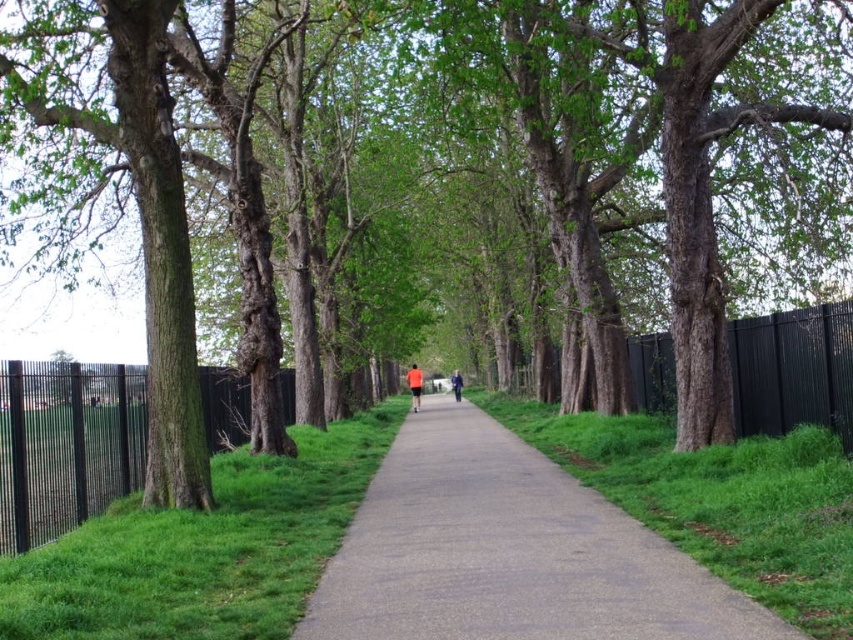
Is gray asphalt path at center shorter than orange fabric at center?

Yes.

Is point (534, 547) behind point (421, 385)?

No, it is not.

Identify the location of gray asphalt path at center. click(509, 552).

Is gray asphalt path at center smaller than orange fabric jacket at center?

Actually, gray asphalt path at center might be larger than orange fabric jacket at center.

Who is more distant from viewer, (451, 611) or (457, 400)?

The point (457, 400) is behind.

Who is more distant from viewer, (589, 548) or (457, 387)?

The point (457, 387) is behind.

Where is `gray asphalt path at center`? This screenshot has width=853, height=640. gray asphalt path at center is located at coordinates (509, 552).

Who is more distant from viewer, (x=408, y=371) or (x=457, y=374)?

Positioned behind is point (x=408, y=371).

The height and width of the screenshot is (640, 853). I want to click on orange fabric at center, so click(x=415, y=385).